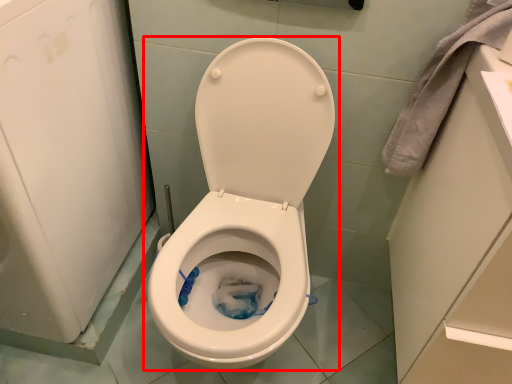
Question: Considering the relative positions of toilet (annotated by the red box) and material in the image provided, where is toilet (annotated by the red box) located with respect to the staircase?

Choices:
 (A) left
 (B) right

Answer: (A)